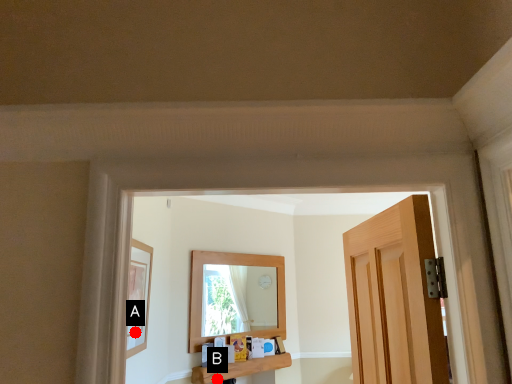
Question: Two points are circled on the image, labeled by A and B beside each circle. Among these points, which one is nearest to the camera?

Choices:
 (A) A is closer
 (B) B is closer

Answer: (A)